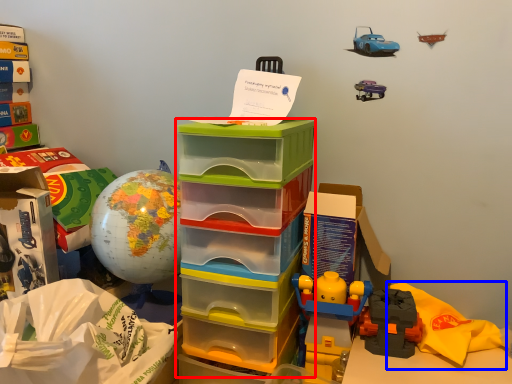
Question: Which object appears closest to the camera in this image, storage box (highlighted by a red box) or material (highlighted by a blue box)?

Choices:
 (A) storage box
 (B) material

Answer: (A)